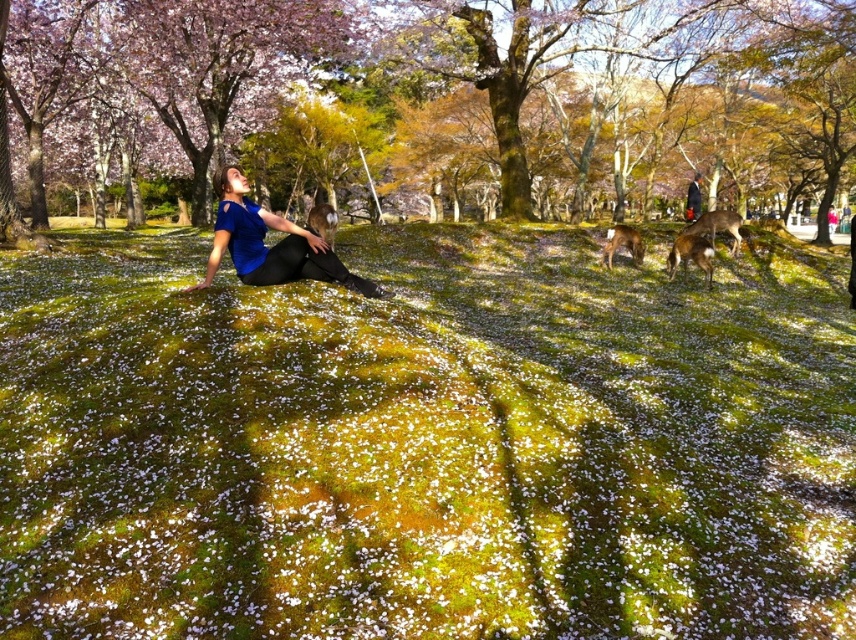
You are a photographer standing at the edge of the grassy area. You want to take a photo that includes both the smooth bark tree at upper center and the brown furry deer at center. Given that your camera has a maximum zoom range of 20 meters, will you be able to capture both subjects in a single frame without moving closer?

The smooth bark tree at upper center is 29.15 meters away from the brown furry deer at center. Since your camera can only zoom up to 20 meters, you won t be able to capture both subjects in a single frame without moving closer.

You are standing in the park and see two points in the scene. The first point is at coordinates point (456, 154) and the second is at point (278, 280). Which point is closer to you?

Point (456, 154) is further to the camera than point (278, 280), so the second point is closer to you.

From the picture: You are a photographer standing in the park and want to take a photo of the smooth bark tree at upper center and the blue matte shirt at center. Which object will appear larger in the photo?

The smooth bark tree at upper center will appear larger in the photo because it is closer to the viewer than the blue matte shirt at center, making it appear bigger in the image.